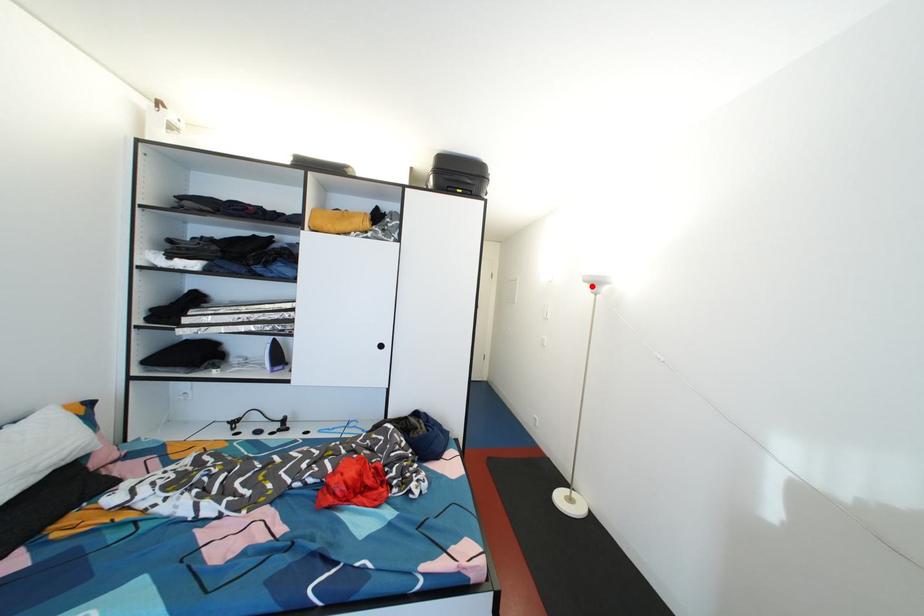
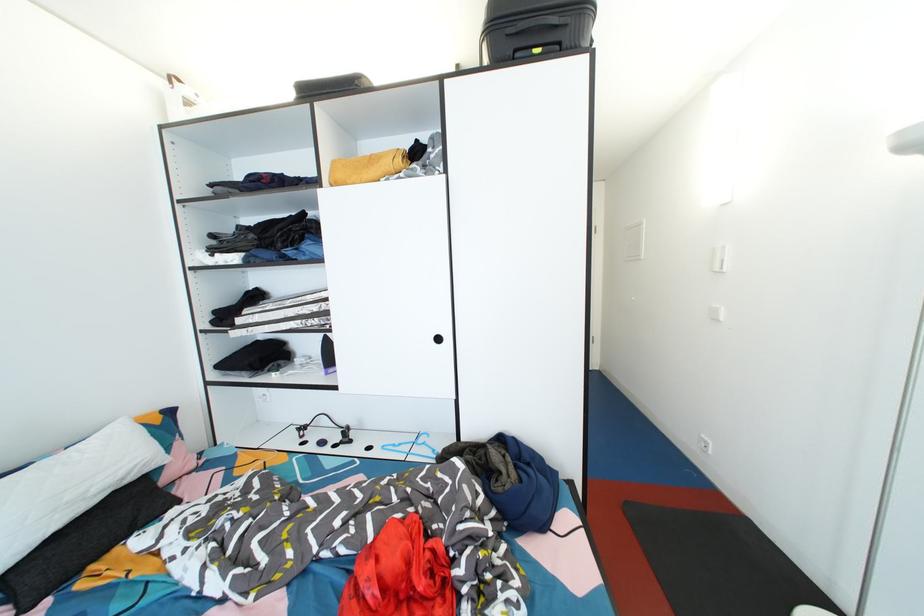
Find the pixel in the second image that matches the highlighted location in the first image.

(913, 152)